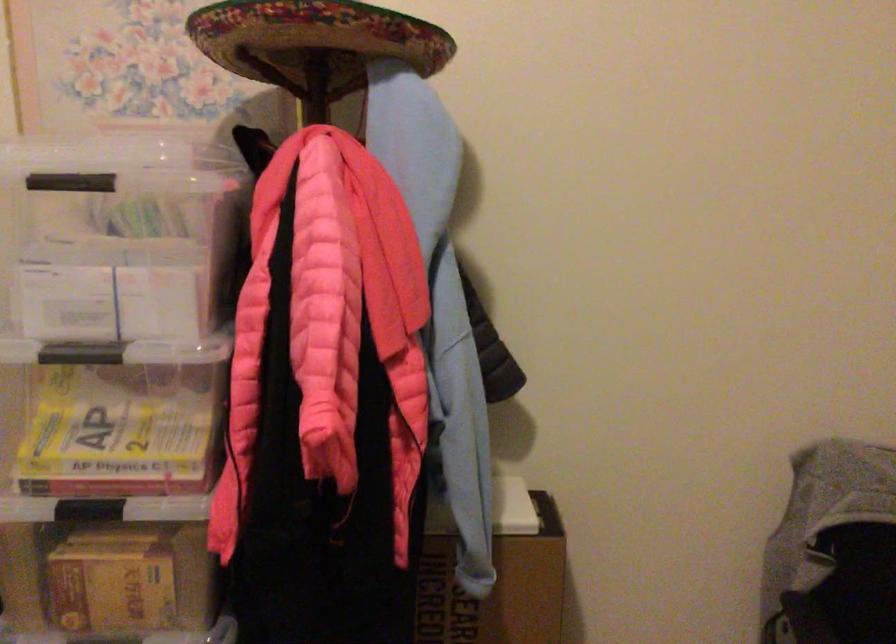
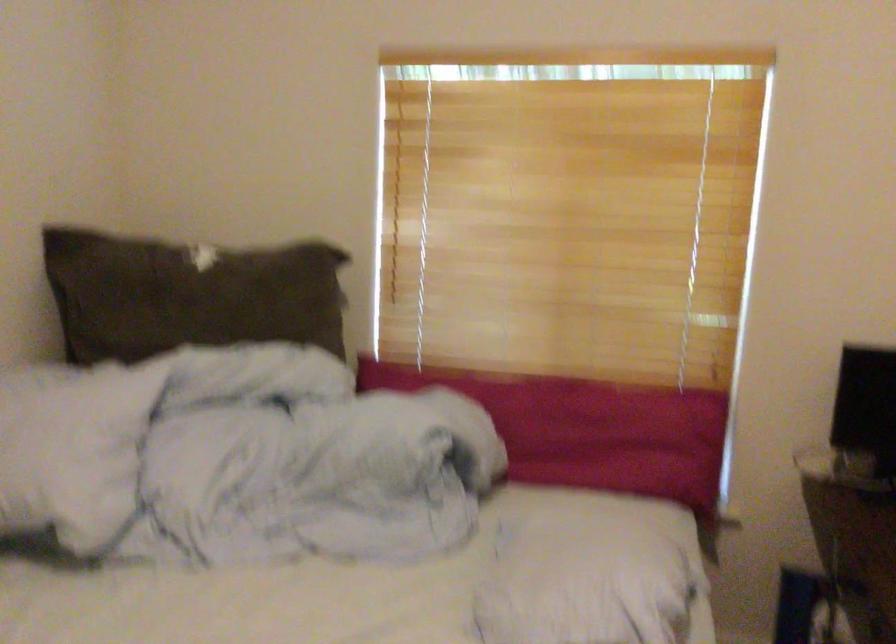
Question: The camera is either moving clockwise (left) or counter-clockwise (right) around the object. The first image is from the beginning of the video and the second image is from the end. Is the camera moving left or right when shooting the video?

Choices:
 (A) Left
 (B) Right

Answer: (B)